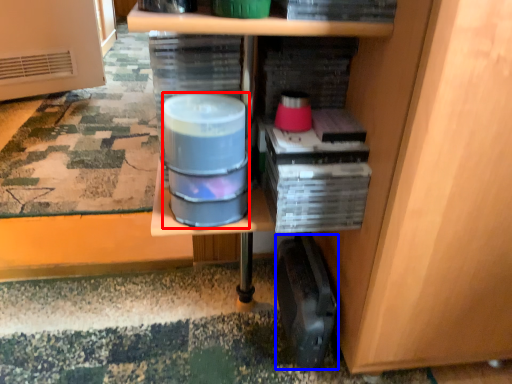
Question: Which of the following is the farthest to the observer, water (highlighted by a red box) or wide (highlighted by a blue box)?

Choices:
 (A) water
 (B) wide

Answer: (B)